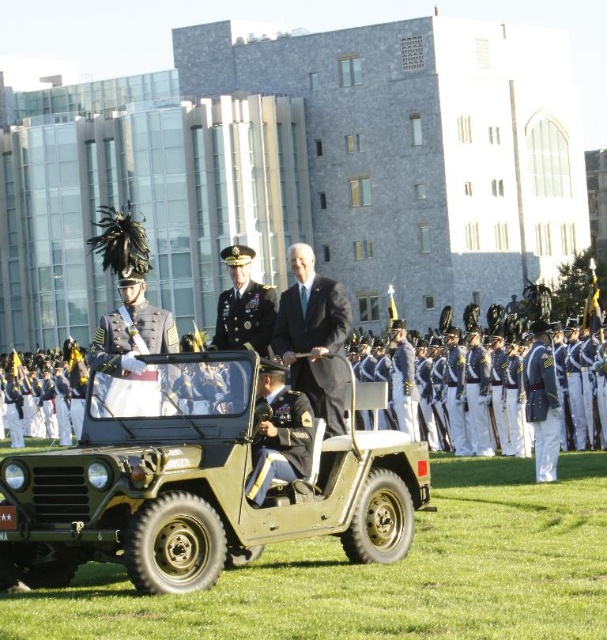
Question: Among these objects, which one is nearest to the camera?

Choices:
 (A) dark blue fabric uniform at center
 (B) matte green metal jeep at center
 (C) black matte suit at center

Answer: (B)

Question: Observing the image, what is the correct spatial positioning of dark blue fabric uniform at center in reference to shiny gold epaulets at center?

Choices:
 (A) below
 (B) above

Answer: (B)

Question: Which object appears farthest from the camera in this image?

Choices:
 (A) matte green metal jeep at center
 (B) shiny gold epaulets at center

Answer: (B)

Question: Which object is farther from the camera taking this photo?

Choices:
 (A) blue uniform at center
 (B) shiny gold uniform at center

Answer: (A)

Question: Can you confirm if matte green metal jeep at center is thinner than dark blue fabric uniform at center?

Choices:
 (A) no
 (B) yes

Answer: (A)

Question: Can you confirm if blue uniform at center is smaller than black matte suit at center?

Choices:
 (A) yes
 (B) no

Answer: (B)